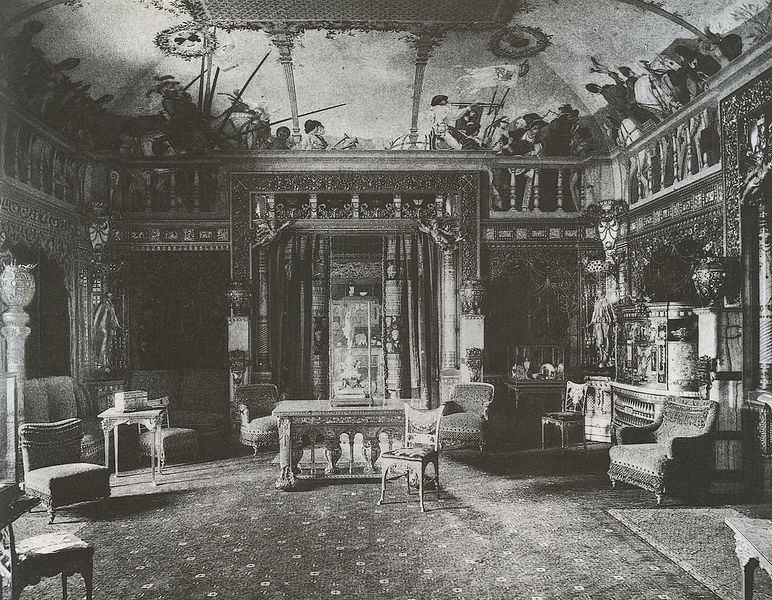
Image resolution: width=772 pixels, height=600 pixels. I want to click on ceiling, so click(x=350, y=74).